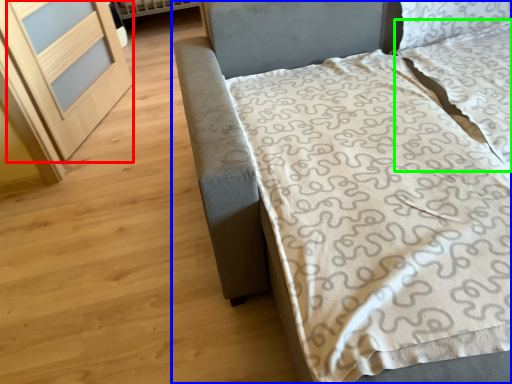
Question: Which object is positioned closest to screen door (highlighted by a red box)? Select from bed (highlighted by a blue box) and pillow (highlighted by a green box).

Choices:
 (A) bed
 (B) pillow

Answer: (A)